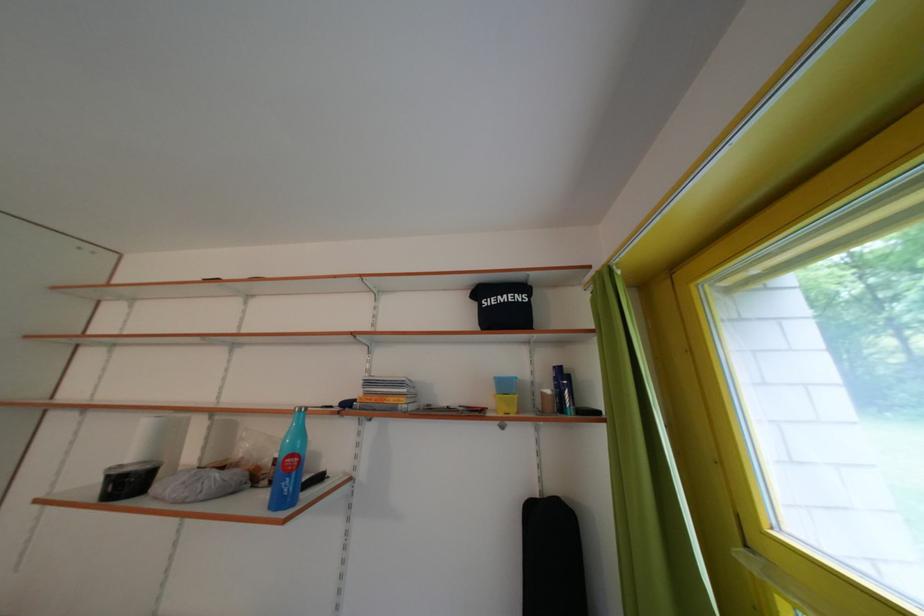
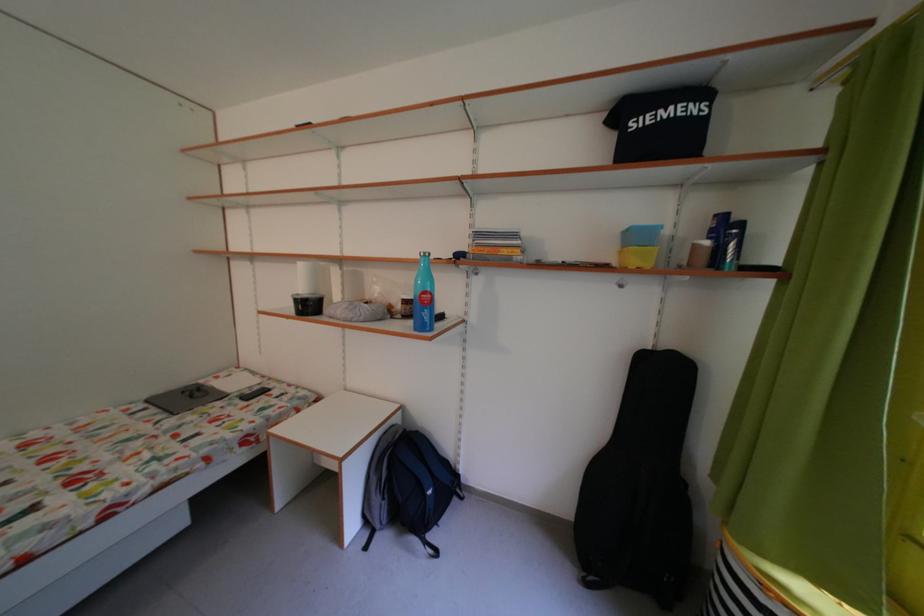
Find the pixel in the second image that matches point (400, 406) in the first image.

(515, 257)